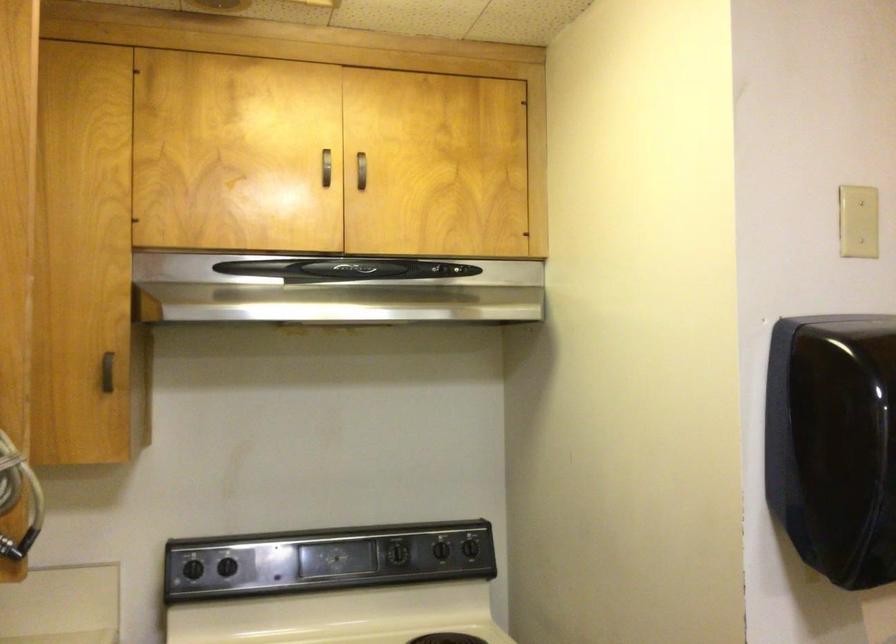
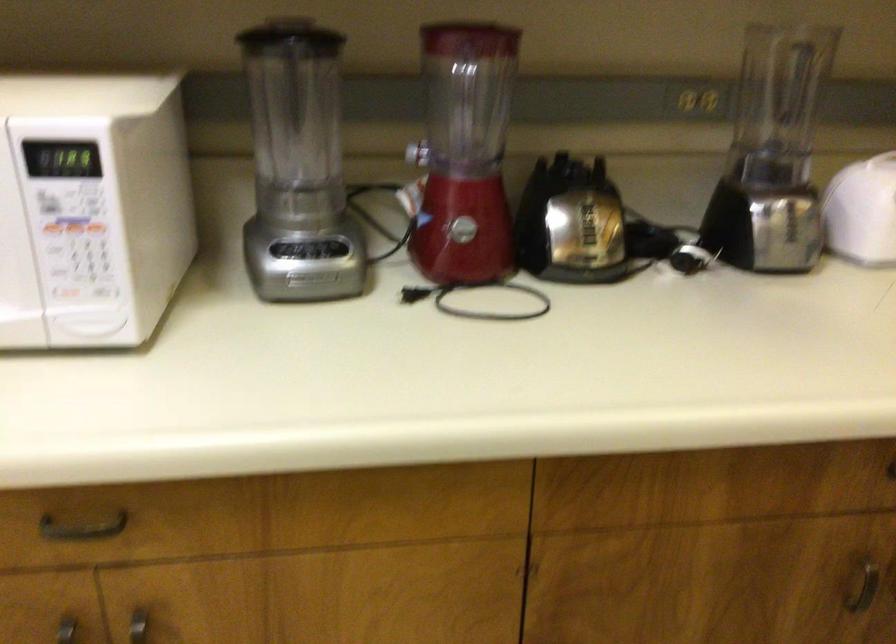
Based on the continuous images, in which direction is the camera rotating?

The camera rotated toward left-down.